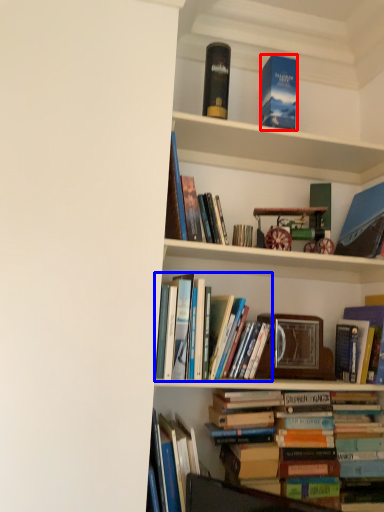
Question: Which point is further to the camera, book (highlighted by a red box) or book (highlighted by a blue box)?

Choices:
 (A) book
 (B) book

Answer: (A)